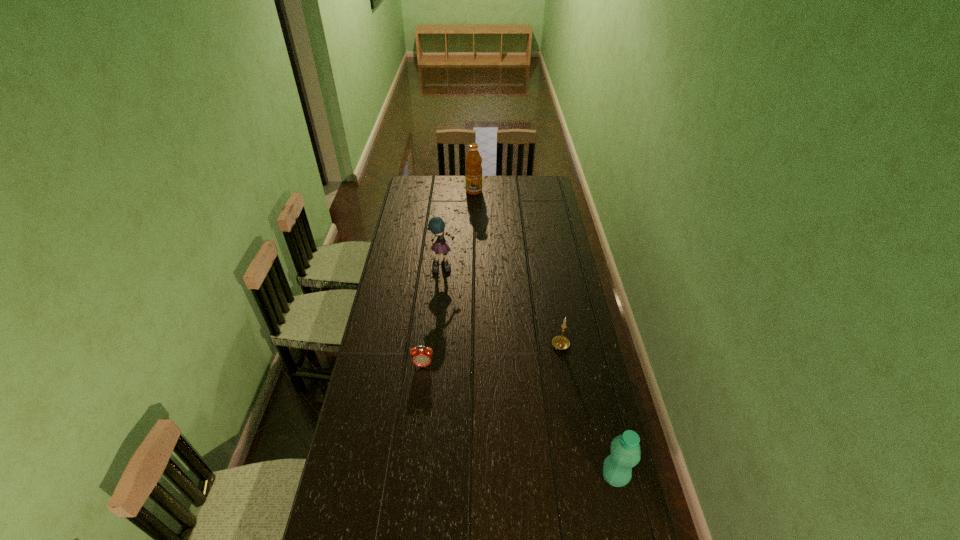
The height and width of the screenshot is (540, 960). Identify the location of free space that satisfies the following two spatial constraints: 1. on the front side of the third shortest object; 2. on the right side of the second shortest object. (584, 476).